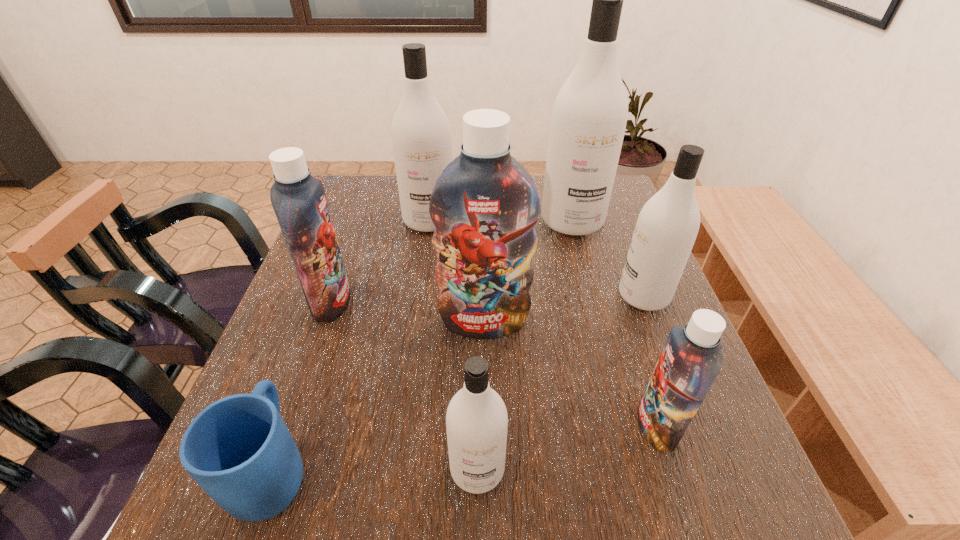
Identify the location of free space between the nearest blue shampoo and the biggest blue shampoo. Image resolution: width=960 pixels, height=540 pixels. (570, 373).

Locate an element on the screen. This screenshot has width=960, height=540. object identified as the sixth closest to the biggest blue shampoo is located at coordinates (421, 135).

At what (x,y) coordinates should I click in order to perform the action: click on the fifth closest object to the second white shampoo from left to right. Please return your answer as a coordinate pair (x, y). Looking at the image, I should click on (667, 226).

Identify which shampoo is the fourth nearest to the rightmost blue shampoo. Please provide its 2D coordinates. Your answer should be formatted as a tuple, i.e. [(x, y)], where the tuple contains the x and y coordinates of a point satisfying the conditions above.

[(589, 116)]

In order to click on the second closest shampoo to the second smallest blue shampoo in this screenshot , I will do `click(485, 204)`.

Locate which white shampoo is the closest to the second smallest blue shampoo. Please provide its 2D coordinates. Your answer should be formatted as a tuple, i.e. [(x, y)], where the tuple contains the x and y coordinates of a point satisfying the conditions above.

[(421, 135)]

The height and width of the screenshot is (540, 960). In order to click on white shampoo identified as the third closest to the biggest white shampoo in this screenshot , I will do `click(476, 420)`.

Select which blue shampoo appears as the second closest to the smallest blue shampoo. Please provide its 2D coordinates. Your answer should be formatted as a tuple, i.e. [(x, y)], where the tuple contains the x and y coordinates of a point satisfying the conditions above.

[(299, 201)]

Choose which blue shampoo is the second nearest neighbor to the leftmost white shampoo. Please provide its 2D coordinates. Your answer should be formatted as a tuple, i.e. [(x, y)], where the tuple contains the x and y coordinates of a point satisfying the conditions above.

[(485, 204)]

Find the location of a particular element. This screenshot has width=960, height=540. free space in the image that satisfies the following two spatial constraints: 1. on the front label of the second smallest blue shampoo; 2. on the side of the mug with the handle is located at coordinates (273, 469).